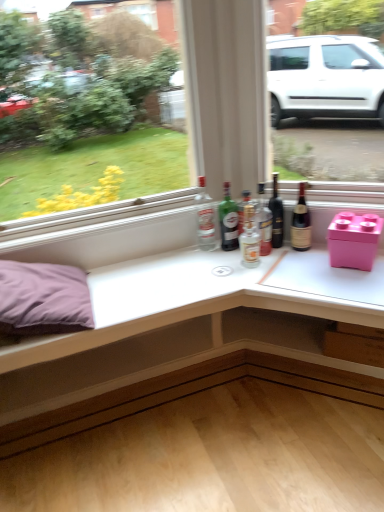
You are a GUI agent. You are given a task and a screenshot of the screen. Output one action in this format:
    pyautogui.click(x=<x>, y=<y>)
    Task: Click on the free space between brown glass bottle at right, the 1th bottle viewed from the right, and pink plastic storage box at right
    This screenshot has height=512, width=384.
    Given the screenshot: What is the action you would take?
    pyautogui.click(x=310, y=255)